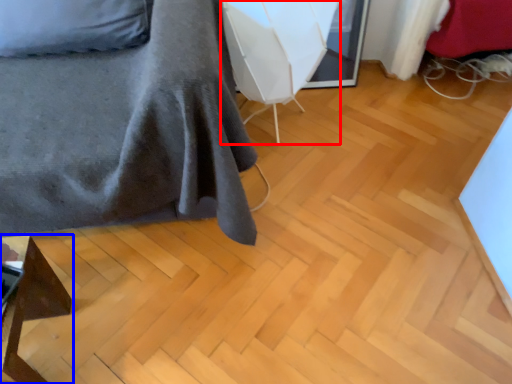
Question: Which of the following is the closest to the observer, swivel chair (highlighted by a red box) or furniture (highlighted by a blue box)?

Choices:
 (A) swivel chair
 (B) furniture

Answer: (B)